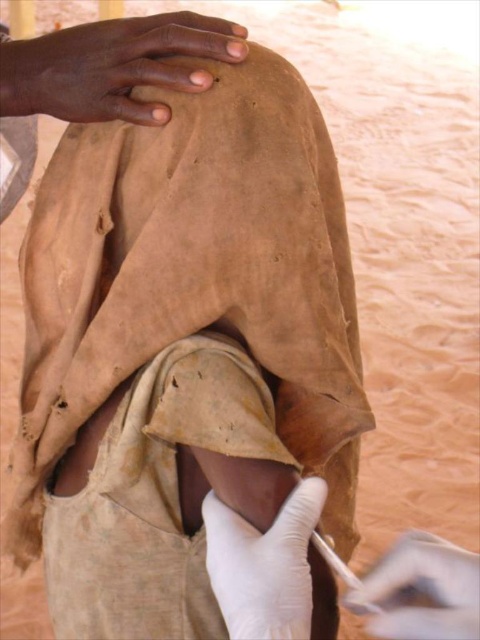
Who is more forward, (0, 100) or (238, 524)?

Point (238, 524) is more forward.

Does smooth skin hand at upper center have a greater height compared to white rubber glove at lower center?

No.

Find the location of `smooth skin hand at upper center`. smooth skin hand at upper center is located at coordinates (112, 67).

Where is `smooth skin hand at upper center`? smooth skin hand at upper center is located at coordinates (112, 67).

Does white rubber glove at lower center have a lesser height compared to white latex glove at lower center?

In fact, white rubber glove at lower center may be taller than white latex glove at lower center.

This screenshot has width=480, height=640. Find the location of `white rubber glove at lower center`. white rubber glove at lower center is located at coordinates (x=264, y=564).

What do you see at coordinates (264, 564) in the screenshot? I see `white rubber glove at lower center` at bounding box center [264, 564].

The height and width of the screenshot is (640, 480). Identify the location of white rubber glove at lower center. (264, 564).

Does smooth skin hand at upper center appear on the right side of white latex glove at lower center?

No, smooth skin hand at upper center is not to the right of white latex glove at lower center.

Between point (13, 92) and point (414, 616), which one is positioned behind?

Positioned behind is point (13, 92).

Which is behind, point (85, 115) or point (360, 596)?

Point (85, 115)

Find the location of a particular element. smooth skin hand at upper center is located at coordinates (112, 67).